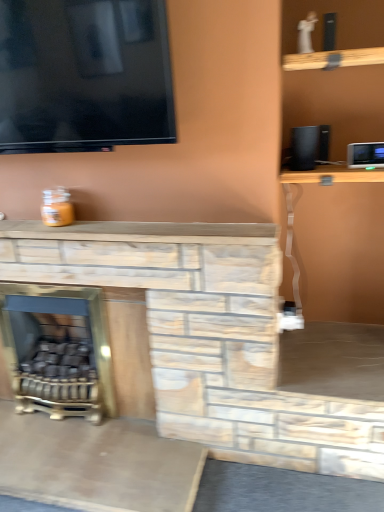
Question: Can you confirm if gold metallic fireplace at lower left is wider than white plastic appliance at upper right?

Choices:
 (A) no
 (B) yes

Answer: (B)

Question: Is white plastic appliance at upper right a part of gold metallic fireplace at lower left?

Choices:
 (A) yes
 (B) no

Answer: (B)

Question: Does gold metallic fireplace at lower left have a lesser height compared to white plastic appliance at upper right?

Choices:
 (A) no
 (B) yes

Answer: (A)

Question: Is gold metallic fireplace at lower left smaller than white plastic appliance at upper right?

Choices:
 (A) yes
 (B) no

Answer: (B)

Question: Can you confirm if gold metallic fireplace at lower left is thinner than white plastic appliance at upper right?

Choices:
 (A) no
 (B) yes

Answer: (A)

Question: From a real-world perspective, is white plastic appliance at upper right physically located above or below gold metallic fireplace at lower left?

Choices:
 (A) above
 (B) below

Answer: (A)

Question: Is white plastic appliance at upper right situated inside gold metallic fireplace at lower left or outside?

Choices:
 (A) inside
 (B) outside

Answer: (B)

Question: From their relative heights in the image, would you say white plastic appliance at upper right is taller or shorter than gold metallic fireplace at lower left?

Choices:
 (A) tall
 (B) short

Answer: (B)

Question: In terms of width, does white plastic appliance at upper right look wider or thinner when compared to gold metallic fireplace at lower left?

Choices:
 (A) wide
 (B) thin

Answer: (B)

Question: Is black matte speaker at upper right inside or outside of white plastic appliance at upper right?

Choices:
 (A) outside
 (B) inside

Answer: (A)

Question: In the image, is black matte speaker at upper right on the left side or the right side of white plastic appliance at upper right?

Choices:
 (A) left
 (B) right

Answer: (A)

Question: From the image's perspective, is black matte speaker at upper right located above or below white plastic appliance at upper right?

Choices:
 (A) above
 (B) below

Answer: (A)

Question: Is point (317, 155) positioned closer to the camera than point (355, 158)?

Choices:
 (A) closer
 (B) farther

Answer: (B)

Question: Based on their positions, is gold metallic fireplace at lower left located to the left or right of black matte speaker at upper right?

Choices:
 (A) left
 (B) right

Answer: (A)

Question: From a real-world perspective, is gold metallic fireplace at lower left physically located above or below black matte speaker at upper right?

Choices:
 (A) above
 (B) below

Answer: (B)